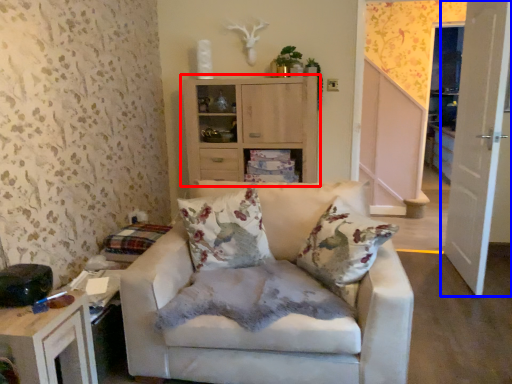
Question: Which point is closer to the camera, cabinetry (highlighted by a red box) or door (highlighted by a blue box)?

Choices:
 (A) cabinetry
 (B) door

Answer: (B)